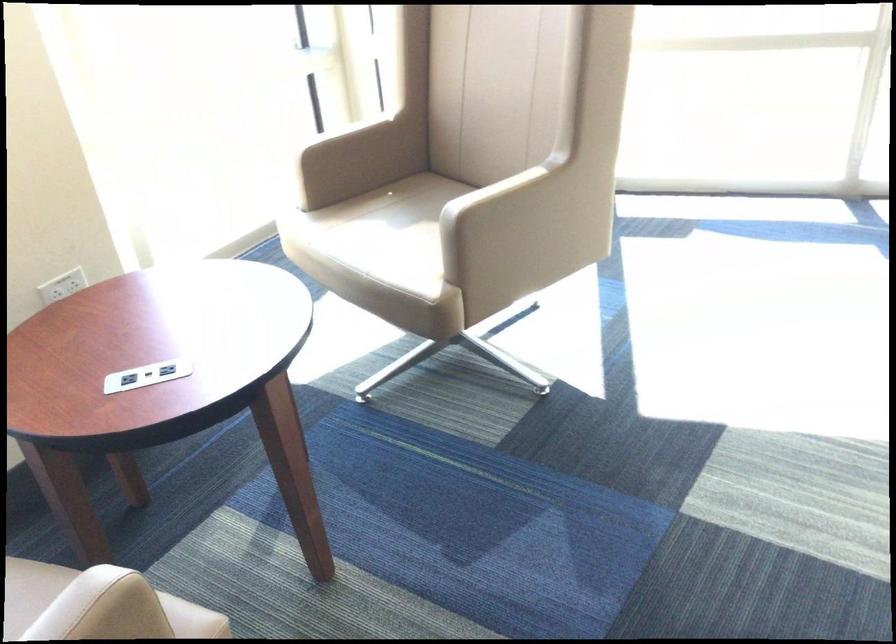
Where would you sit the chair sitting surface? Please return your answer as a coordinate pair (x, y).

(409, 222)